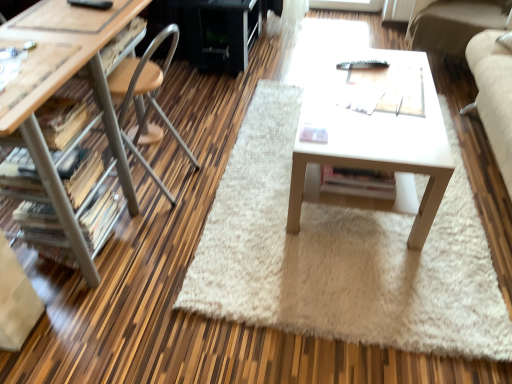
Question: In the image, is white shaggy rug at center on the left side or the right side of matte wood desk at left?

Choices:
 (A) right
 (B) left

Answer: (A)

Question: From a real-world perspective, is white shaggy rug at center physically located above or below matte wood desk at left?

Choices:
 (A) below
 (B) above

Answer: (A)

Question: Which object is positioned farthest from the white shaggy rug at center?

Choices:
 (A) white matte table at center
 (B) matte wood desk at left
 (C) black glossy entertainment center at upper center
 (D) wooden drawer at left
 (E) suede-like beige couch at upper right

Answer: (E)

Question: Which object is positioned farthest from the wooden drawer at left?

Choices:
 (A) suede-like beige couch at upper right
 (B) black glossy entertainment center at upper center
 (C) matte wood desk at left
 (D) white matte table at center
 (E) white shaggy rug at center

Answer: (A)